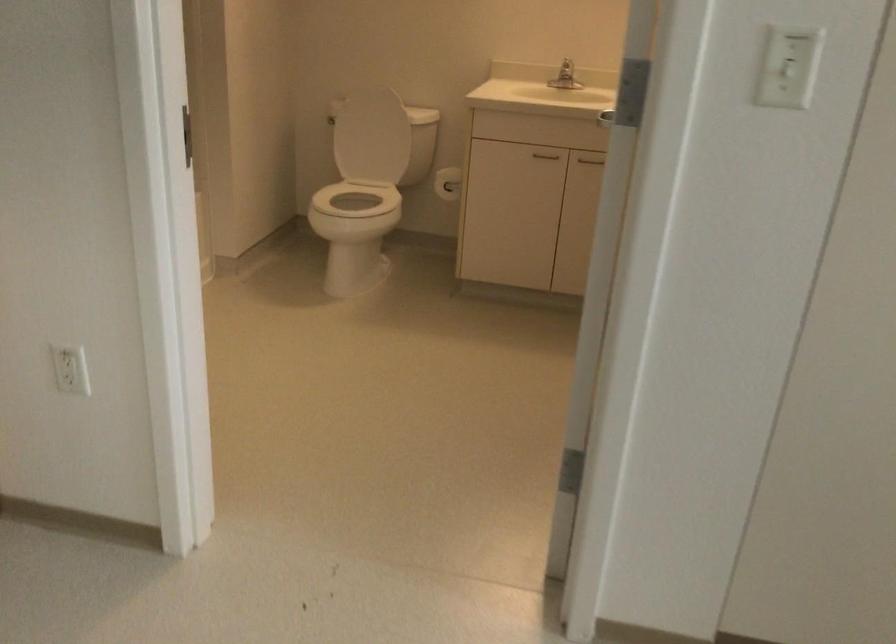
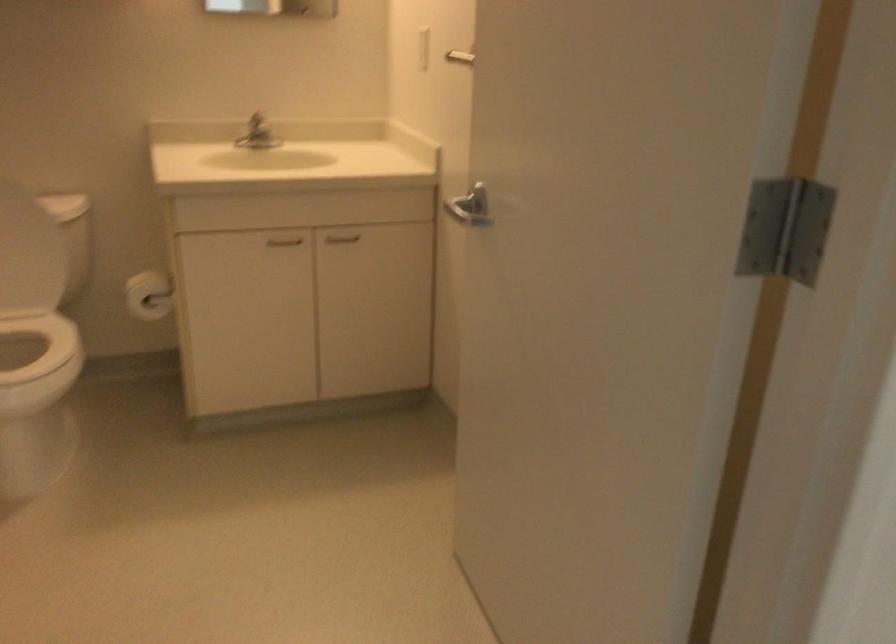
The point at (547, 156) is marked in the first image. Where is the corresponding point in the second image?

(283, 241)